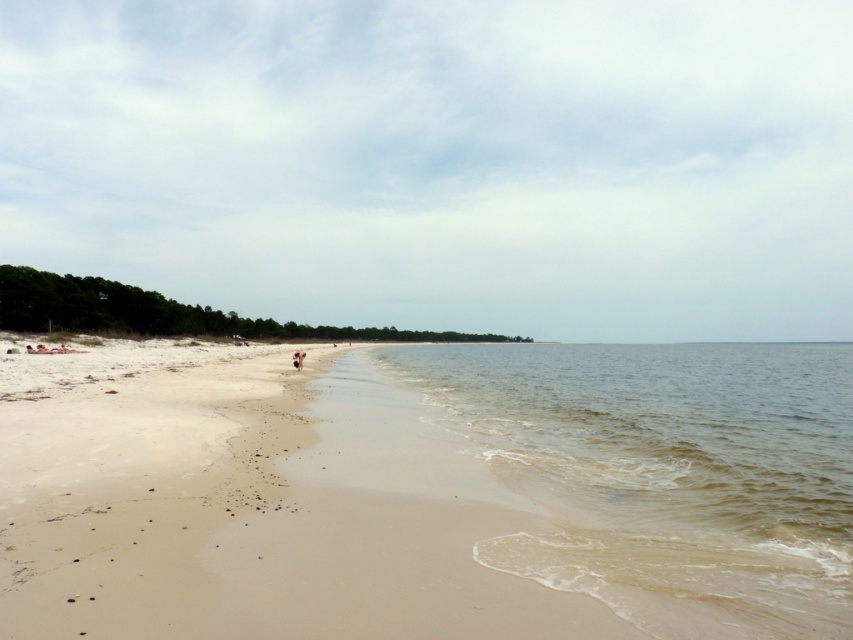
Question: Can you confirm if sandy beach at lower left is positioned to the left of clear water at lower right?

Choices:
 (A) yes
 (B) no

Answer: (A)

Question: Is sandy beach at lower left to the left of clear water at lower right from the viewer's perspective?

Choices:
 (A) yes
 (B) no

Answer: (A)

Question: Among these points, which one is farthest from the camera?

Choices:
 (A) (386, 552)
 (B) (500, 397)

Answer: (B)

Question: Where is sandy beach at lower left located in relation to clear water at lower right in the image?

Choices:
 (A) below
 (B) above

Answer: (B)